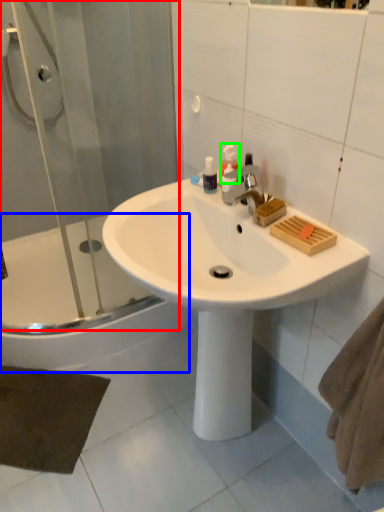
Question: Considering the real-world distances, which object is closest to shower door (highlighted by a red box)? bathtub (highlighted by a blue box) or soap dispenser (highlighted by a green box).

Choices:
 (A) bathtub
 (B) soap dispenser

Answer: (A)